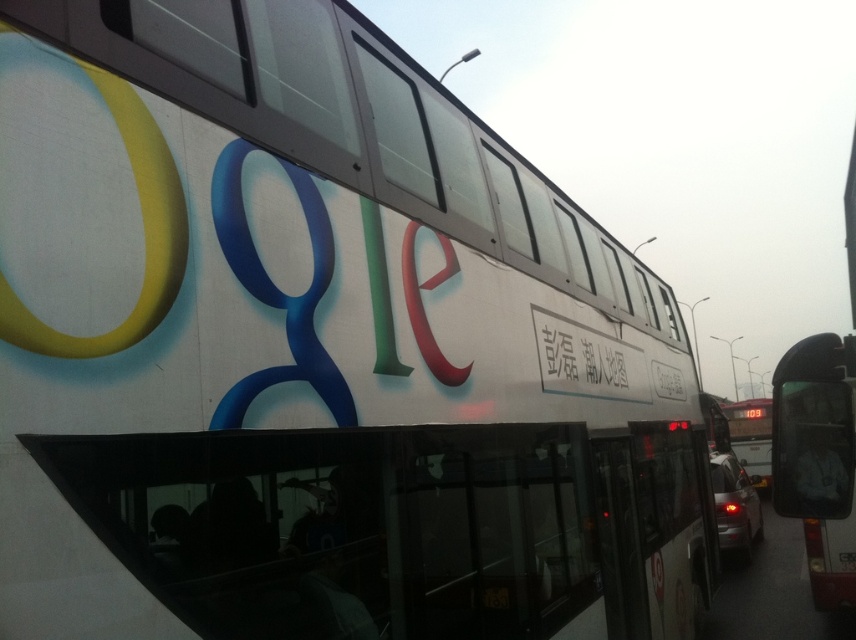
You are a pedestrian standing in the middle of the street. You see a black matte sign at center and a white matte bus at center. Which object takes up more space in the image?

The white matte bus at center takes up more space in the image than the black matte sign at center because the black matte sign at center occupies less space than white matte bus at center.

You are a pedestrian standing on the sidewalk and see the white glossy bus at right and the black matte sign at center. Which object is closer to you?

The white glossy bus at right is closer to you because it is further to the viewer than the black matte sign at center.